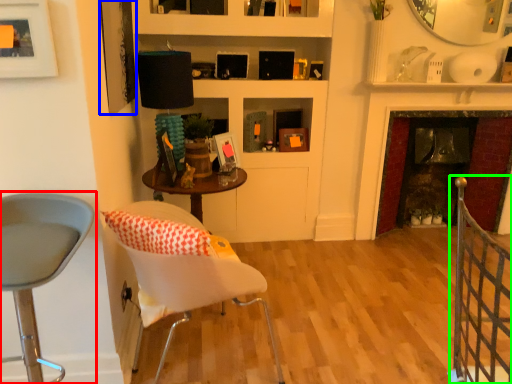
Question: Which object is positioned closest to chair (highlighted by a red box)? Select from picture frame (highlighted by a blue box) and rail (highlighted by a green box).

Choices:
 (A) picture frame
 (B) rail

Answer: (A)